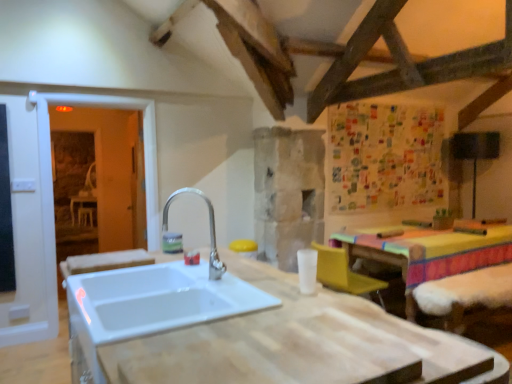
Question: From the image's perspective, would you say white wood countertop at center is positioned over white ceramic sink at center?

Choices:
 (A) no
 (B) yes

Answer: (A)

Question: From a real-world perspective, is white wood countertop at center physically below white ceramic sink at center?

Choices:
 (A) yes
 (B) no

Answer: (A)

Question: Considering the relative positions of white wood countertop at center and white ceramic sink at center in the image provided, is white wood countertop at center behind white ceramic sink at center?

Choices:
 (A) yes
 (B) no

Answer: (B)

Question: Is white wood countertop at center oriented away from white ceramic sink at center?

Choices:
 (A) no
 (B) yes

Answer: (A)

Question: Is white wood countertop at center closer to the viewer compared to white ceramic sink at center?

Choices:
 (A) yes
 (B) no

Answer: (A)

Question: Considering the relative positions of white wood countertop at center and transparent glass door at left in the image provided, is white wood countertop at center to the left or to the right of transparent glass door at left?

Choices:
 (A) right
 (B) left

Answer: (A)

Question: From the image's perspective, relative to transparent glass door at left, is white wood countertop at center above or below?

Choices:
 (A) above
 (B) below

Answer: (B)

Question: In terms of height, does white wood countertop at center look taller or shorter compared to transparent glass door at left?

Choices:
 (A) short
 (B) tall

Answer: (A)

Question: In terms of size, does white wood countertop at center appear bigger or smaller than transparent glass door at left?

Choices:
 (A) big
 (B) small

Answer: (A)

Question: Considering the positions of transparent glass door at left and white ceramic sink at center in the image, is transparent glass door at left taller or shorter than white ceramic sink at center?

Choices:
 (A) short
 (B) tall

Answer: (B)

Question: From a real-world perspective, is transparent glass door at left physically located above or below white ceramic sink at center?

Choices:
 (A) below
 (B) above

Answer: (A)

Question: Considering the positions of point (101, 97) and point (170, 283), is point (101, 97) closer or farther from the camera than point (170, 283)?

Choices:
 (A) closer
 (B) farther

Answer: (B)

Question: In the image, is transparent glass door at left positioned in front of or behind white ceramic sink at center?

Choices:
 (A) front
 (B) behind

Answer: (B)

Question: In terms of height, does yellow plastic armchair at lower right look taller or shorter compared to white ceramic sink at center?

Choices:
 (A) short
 (B) tall

Answer: (A)

Question: From the image's perspective, is yellow plastic armchair at lower right located above or below white ceramic sink at center?

Choices:
 (A) below
 (B) above

Answer: (A)